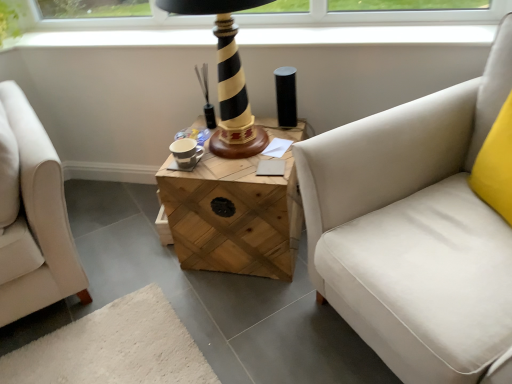
Question: Based on their positions, is black striped wood table lamp at center located to the left or right of white fabric studio couch at right?

Choices:
 (A) right
 (B) left

Answer: (B)

Question: Considering the positions of point (223, 109) and point (332, 163), is point (223, 109) closer or farther from the camera than point (332, 163)?

Choices:
 (A) farther
 (B) closer

Answer: (A)

Question: Which of these objects is positioned closest to the white fabric studio couch at right?

Choices:
 (A) black striped wood table lamp at center
 (B) wooden crate at center

Answer: (B)

Question: Based on their relative distances, which object is farther from the black striped wood table lamp at center?

Choices:
 (A) white fabric studio couch at right
 (B) wooden crate at center

Answer: (A)